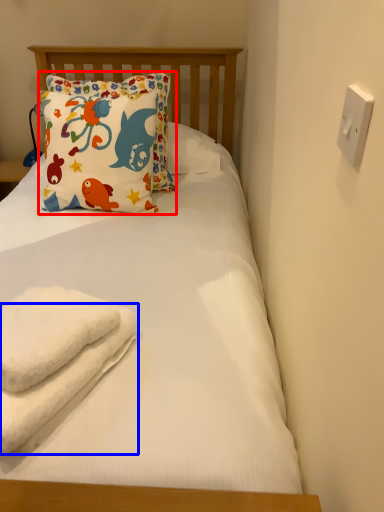
Question: Which object appears farthest to the camera in this image, pillow (highlighted by a red box) or beach towel (highlighted by a blue box)?

Choices:
 (A) pillow
 (B) beach towel

Answer: (A)